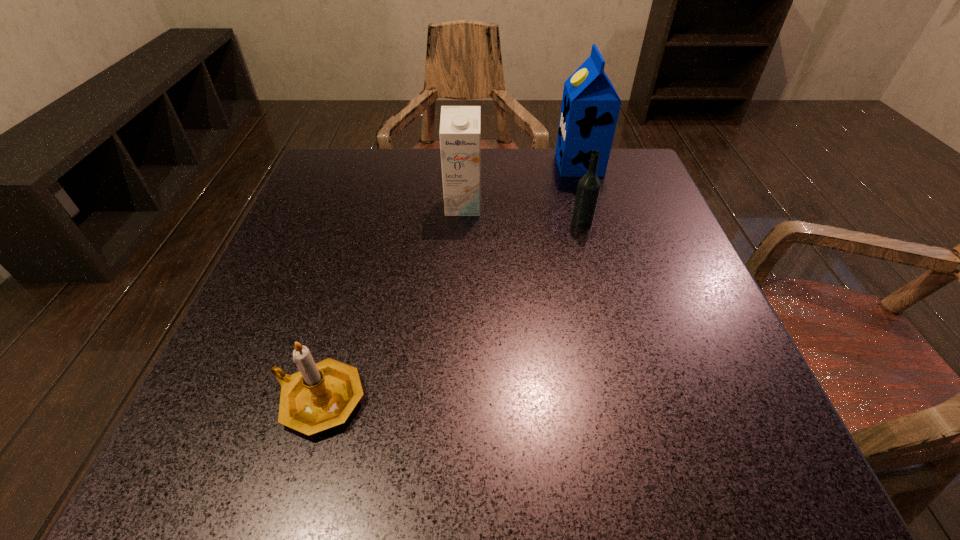
The height and width of the screenshot is (540, 960). I want to click on free space at the near edge of the desktop, so click(x=473, y=480).

The image size is (960, 540). In order to click on vacant space at the left edge of the desktop in this screenshot , I will do `click(292, 299)`.

The height and width of the screenshot is (540, 960). In order to click on free spot at the right edge of the desktop in this screenshot , I will do `click(747, 404)`.

The image size is (960, 540). Find the location of `vacant space at the far left corner`. vacant space at the far left corner is located at coordinates (341, 153).

At what (x,y) coordinates should I click in order to perform the action: click on vacant space at the far right corner of the desktop. Please return your answer as a coordinate pair (x, y). This screenshot has width=960, height=540. Looking at the image, I should click on (650, 176).

In the image, there is a desktop. At what (x,y) coordinates should I click in order to perform the action: click on vacant space at the near right corner. Please return your answer as a coordinate pair (x, y). The height and width of the screenshot is (540, 960). Looking at the image, I should click on (699, 474).

The image size is (960, 540). In order to click on vacant area that lies between the shortest object and the third farthest object in this screenshot , I will do `click(450, 312)`.

You are a GUI agent. You are given a task and a screenshot of the screen. Output one action in this format:
    pyautogui.click(x=<x>, y=<y>)
    Task: Click on the unoccupied area between the vodka and the leftmost object
    
    Given the screenshot: What is the action you would take?
    pyautogui.click(x=450, y=312)

Find the location of a particular element. The image size is (960, 540). vacant area that lies between the second tallest object and the farthest object is located at coordinates (521, 185).

Locate an element on the screen. Image resolution: width=960 pixels, height=540 pixels. empty location between the third shortest object and the candle holder is located at coordinates (391, 303).